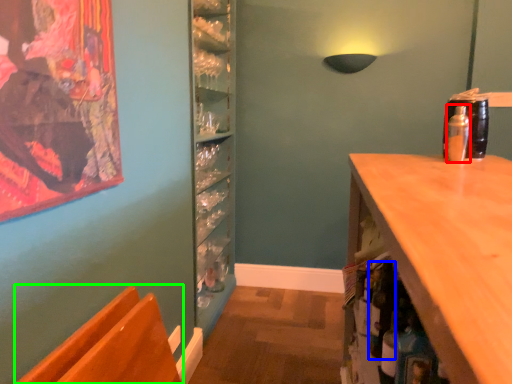
Question: Based on their relative distances, which object is nearer to bottle (highlighted by a red box)? Choose from bottle (highlighted by a blue box) and chair (highlighted by a green box).

Choices:
 (A) bottle
 (B) chair

Answer: (A)